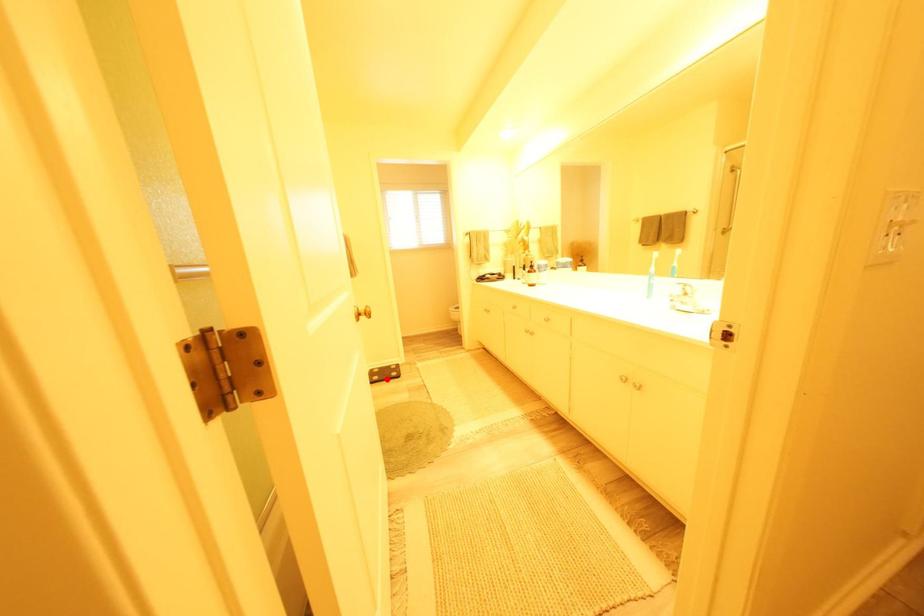
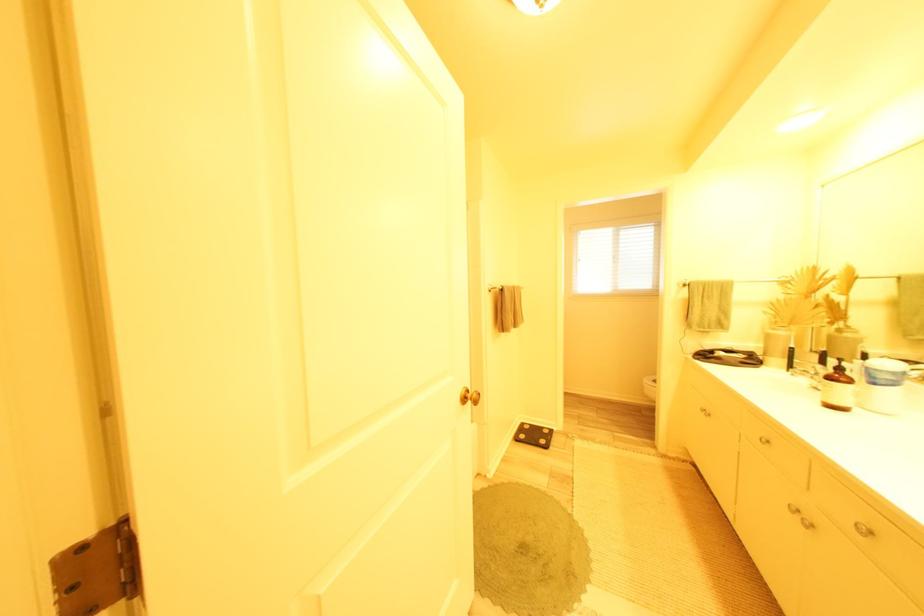
Question: A red point is marked in image1. In image2, is the corresponding 3D point closer to the camera or farther? Reply with the corresponding letter.

Choices:
 (A) The corresponding 3D point is closer.
 (B) The corresponding 3D point is farther.

Answer: (B)